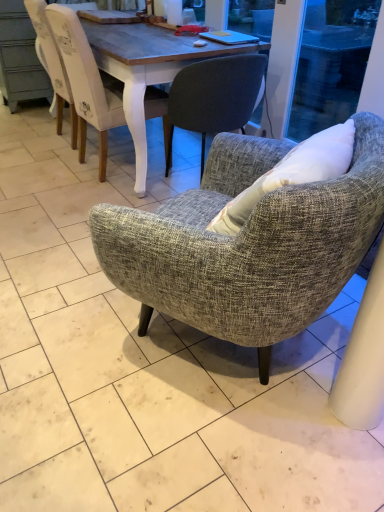
Question: Based on their positions, is white painted wood chair at upper left, the 3th chair in the front-to-back sequence, located to the left or right of textured gray armchair at center, the first chair in the front-to-back sequence?

Choices:
 (A) left
 (B) right

Answer: (A)

Question: Is point (84, 33) closer or farther from the camera than point (261, 239)?

Choices:
 (A) farther
 (B) closer

Answer: (A)

Question: Which is farther from the textured gray armchair at center, the 2th chair when ordered from back to front?

Choices:
 (A) textured gray armchair at center, the 3th chair when ordered from back to front
 (B) white painted wood chair at upper left, the 3th chair in the front-to-back sequence

Answer: (A)

Question: Which object is positioned farthest from the textured gray armchair at center, the first chair in the front-to-back sequence?

Choices:
 (A) textured gray armchair at center, which ranks as the second chair in front-to-back order
 (B) white painted wood chair at upper left, which is the first chair in back-to-front order

Answer: (B)